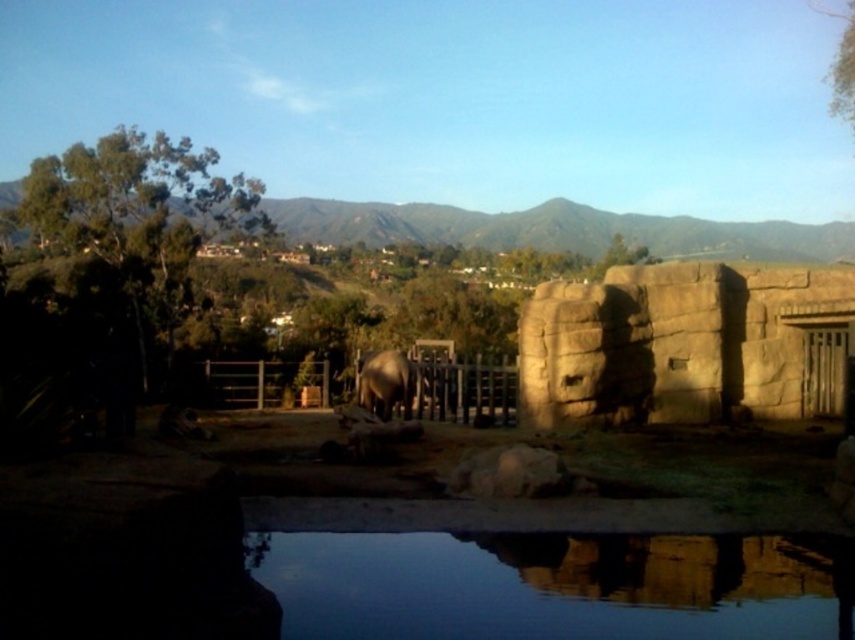
Who is taller, smooth reflective water at lower center or gray matte elephant at center?

gray matte elephant at center is taller.

Is smooth reflective water at lower center above gray matte elephant at center?

Incorrect, smooth reflective water at lower center is not positioned above gray matte elephant at center.

Who is more distant from viewer, (545, 515) or (360, 394)?

The point (360, 394) is more distant.

Identify the location of smooth reflective water at lower center. (538, 572).

Who is lower down, smooth reflective water at lower center or brown stone wall at center right?

smooth reflective water at lower center

Which of these two, smooth reflective water at lower center or brown stone wall at center right, stands taller?

With more height is brown stone wall at center right.

Between point (461, 612) and point (703, 316), which one is positioned in front?

Point (461, 612) is in front.

Image resolution: width=855 pixels, height=640 pixels. Identify the location of smooth reflective water at lower center. (538, 572).

Can you confirm if smooth reflective water at lower center is thinner than brown wooden fence at center?

Yes.

Which is more to the left, smooth reflective water at lower center or brown wooden fence at center?

brown wooden fence at center is more to the left.

Which is behind, point (342, 529) or point (332, 378)?

Point (332, 378)

Locate an element on the screen. This screenshot has height=640, width=855. smooth reflective water at lower center is located at coordinates (538, 572).